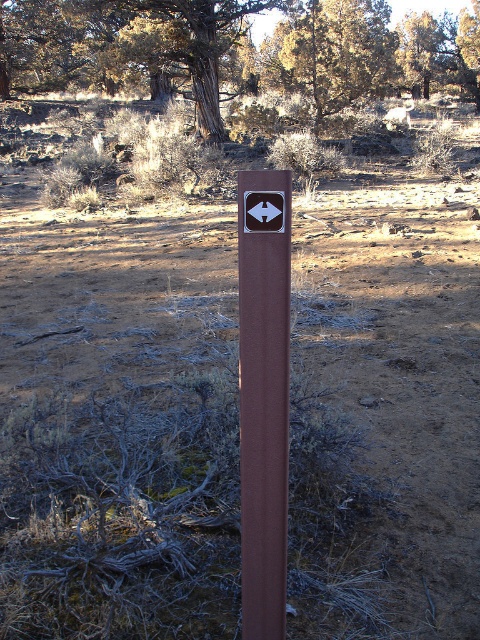
Which is behind, point (37, 58) or point (253, 554)?

The point (37, 58) is behind.

Which is above, brown textured tree at center or brown polished post at center?

Positioned higher is brown textured tree at center.

Which is behind, point (232, 51) or point (286, 525)?

The point (232, 51) is more distant.

Image resolution: width=480 pixels, height=640 pixels. Find the location of `brown textured tree at center`. brown textured tree at center is located at coordinates (237, 51).

Is brown dirt field at center thinner than brown textured tree at center?

Yes.

Is brown dirt field at center to the right of brown textured tree at center from the viewer's perspective?

Incorrect, brown dirt field at center is not on the right side of brown textured tree at center.

Where is `brown dirt field at center`? This screenshot has height=640, width=480. brown dirt field at center is located at coordinates tap(119, 422).

The image size is (480, 640). Find the location of `brown dirt field at center`. brown dirt field at center is located at coordinates (119, 422).

Does brown dirt field at center have a lesser width compared to brown polished post at center?

No, brown dirt field at center is not thinner than brown polished post at center.

Who is positioned more to the right, brown dirt field at center or brown polished post at center?

Positioned to the right is brown polished post at center.

Does point (58, 376) come closer to viewer compared to point (247, 193)?

No, it is not.

This screenshot has height=640, width=480. Find the location of `brown dirt field at center`. brown dirt field at center is located at coordinates (119, 422).